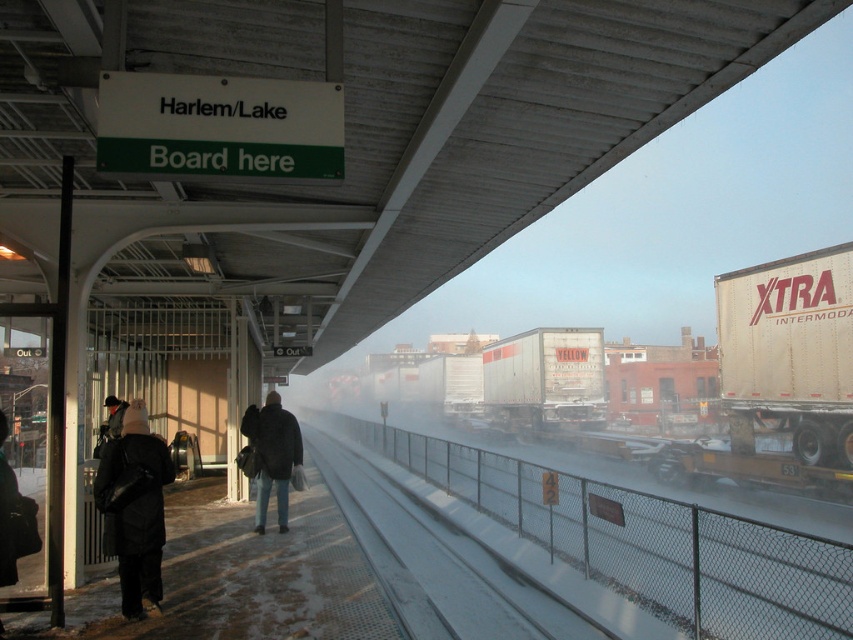
Which is behind, point (267, 484) or point (111, 410)?

The point (111, 410) is more distant.

Is the position of dark gray jacket at center less distant than that of dark gray jacket at left?

Yes, it is in front of dark gray jacket at left.

Which is behind, point (289, 420) or point (105, 400)?

Positioned behind is point (105, 400).

Identify the location of dark gray jacket at center. The image size is (853, 640). tap(271, 454).

Who is more distant from viewer, (x=822, y=449) or (x=254, y=422)?

Point (x=822, y=449)

Can you confirm if beige matte trailer truck at right is bigger than dark gray jacket at center?

Correct, beige matte trailer truck at right is larger in size than dark gray jacket at center.

Where is `beige matte trailer truck at right`? beige matte trailer truck at right is located at coordinates (782, 374).

Based on the photo, which is more to the left, yellow matte trailer truck at center or black matte coat at left?

black matte coat at left is more to the left.

Does yellow matte trailer truck at center lie behind black matte coat at left?

Yes, it is.

Find the location of a particular element. Image resolution: width=853 pixels, height=640 pixels. yellow matte trailer truck at center is located at coordinates (544, 380).

Where is `yellow matte trailer truck at center`? yellow matte trailer truck at center is located at coordinates (544, 380).